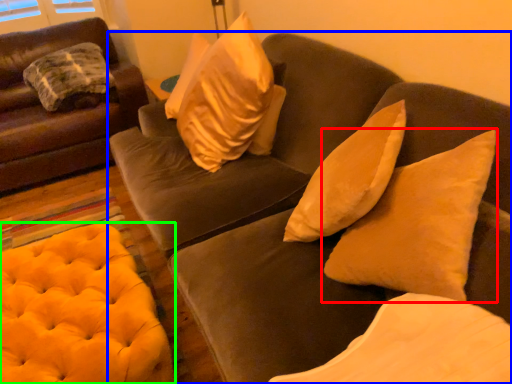
Question: Estimate the real-world distances between objects in this image. Which object is farther from pillow (highlighted by a red box), studio couch (highlighted by a blue box) or stool (highlighted by a green box)?

Choices:
 (A) studio couch
 (B) stool

Answer: (B)